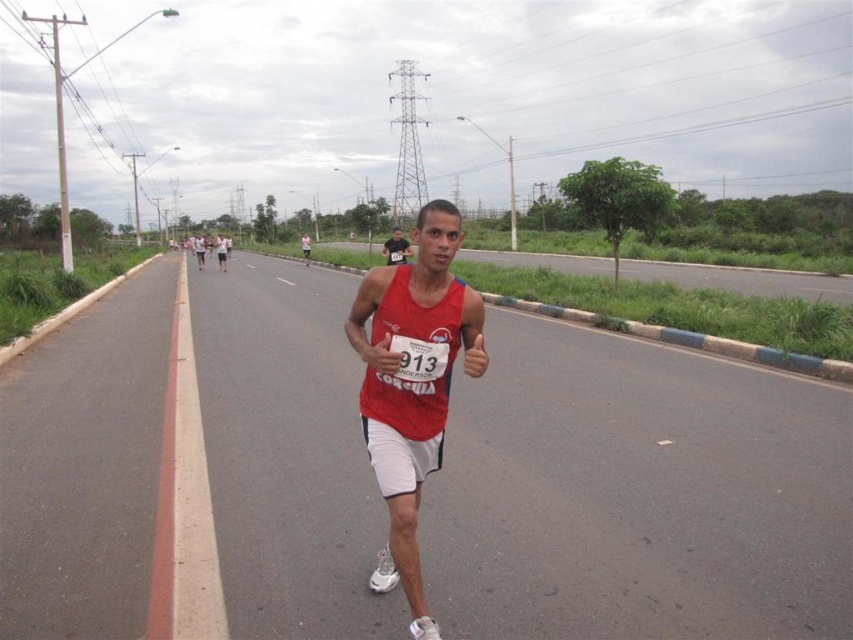
Question: Is red matte tank top at center bigger than matte red tank top at center?

Choices:
 (A) yes
 (B) no

Answer: (B)

Question: Which object appears closest to the camera in this image?

Choices:
 (A) matte red tank top at center
 (B) red matte tank top at center

Answer: (B)

Question: Is red matte tank top at center in front of matte red tank top at center?

Choices:
 (A) no
 (B) yes

Answer: (B)

Question: Can you confirm if red matte tank top at center is bigger than matte red tank top at center?

Choices:
 (A) yes
 (B) no

Answer: (B)